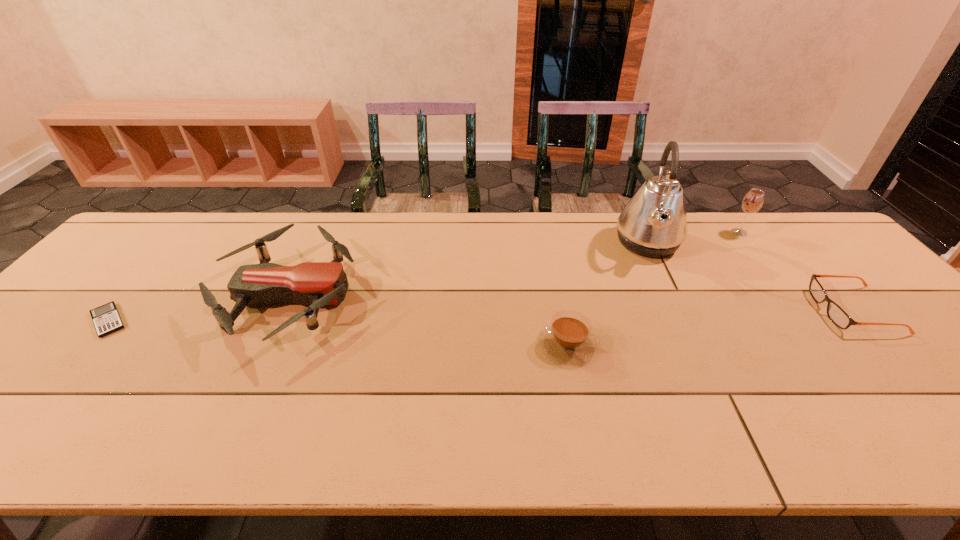
You are a GUI agent. You are given a task and a screenshot of the screen. Output one action in this format:
    pyautogui.click(x=<x>, y=<y>)
    Task: Click on the free space at the near left corner
    
    Given the screenshot: What is the action you would take?
    pyautogui.click(x=12, y=423)

Find the location of `free spot between the wineglass and the third object from right to left`. free spot between the wineglass and the third object from right to left is located at coordinates (693, 238).

Where is `vacant space that's between the tallest object and the third shortest object`? vacant space that's between the tallest object and the third shortest object is located at coordinates (608, 294).

I want to click on vacant area that lies between the kettle and the second tallest object, so click(x=693, y=238).

I want to click on vacant area that lies between the rightmost object and the wineglass, so click(797, 271).

Where is `free space between the spectacles and the fourth tallest object`? free space between the spectacles and the fourth tallest object is located at coordinates (710, 327).

The image size is (960, 540). Identify the location of vacant region between the shortest object and the drone. (198, 308).

This screenshot has height=540, width=960. What are the coordinates of `free spot between the rightmost object and the drone` in the screenshot? It's located at (571, 303).

At what (x,y) coordinates should I click in order to perform the action: click on vacant area that lies between the wineglass and the spectacles. Please return your answer as a coordinate pair (x, y). This screenshot has width=960, height=540. Looking at the image, I should click on (797, 271).

The image size is (960, 540). I want to click on free space that is in between the second object from right to left and the cappuccino, so click(653, 289).